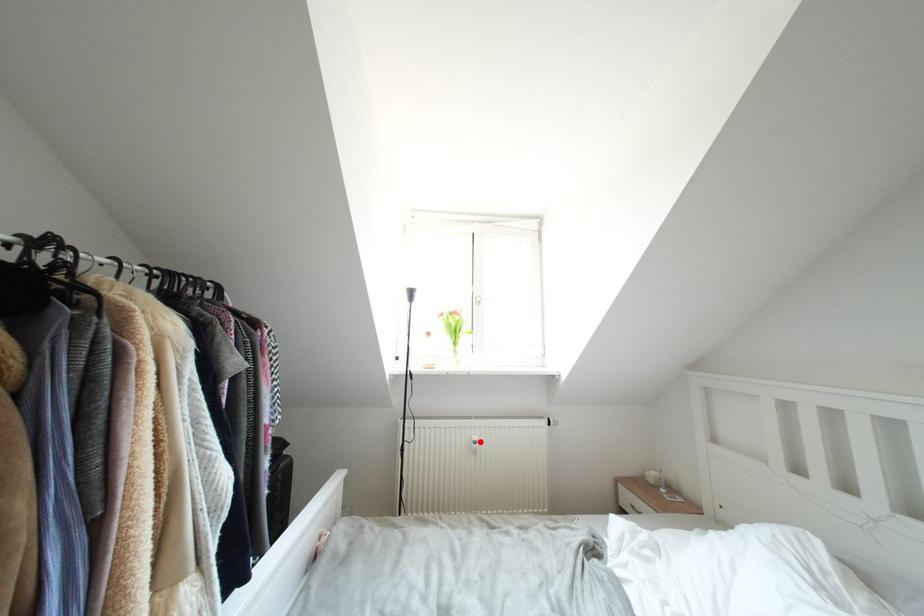
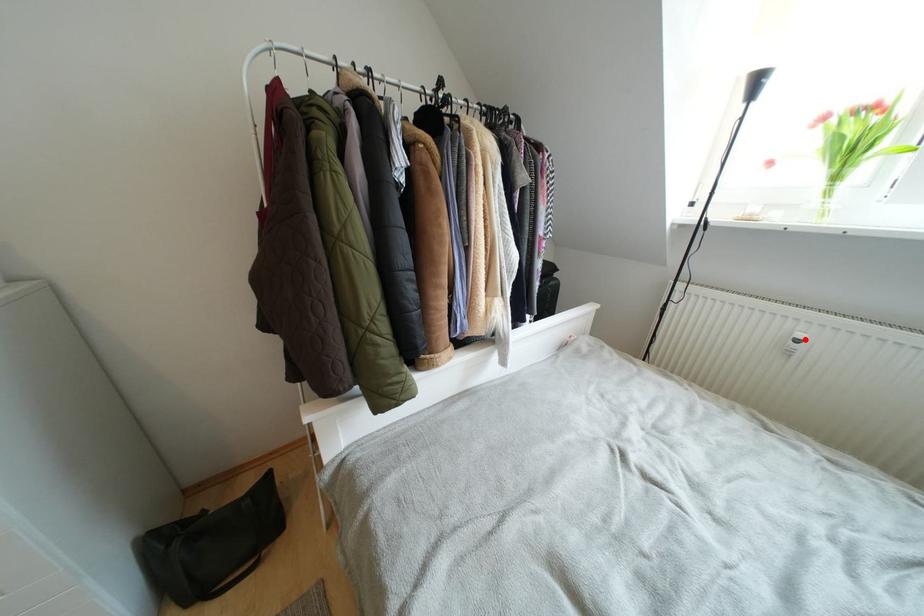
I am providing you with two images of the same scene from different viewpoints. A red point is marked on the first image and another point is marked on the second image. Do the highlighted points in image1 and image2 indicate the same real-world spot?

Yes